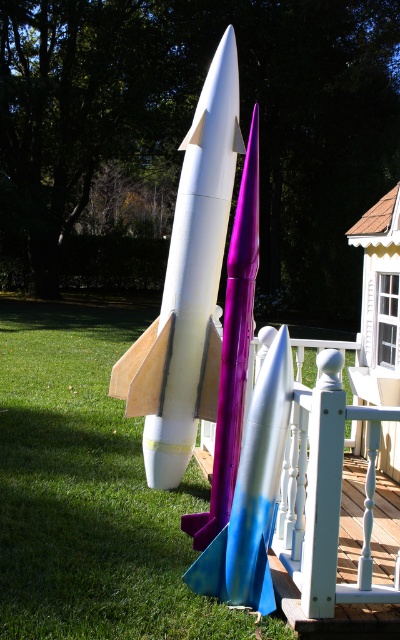
Which is behind, point (249, 413) or point (233, 240)?

Point (233, 240)

Where is `matte purple rocket at center`? This screenshot has width=400, height=640. matte purple rocket at center is located at coordinates (252, 493).

Identify the location of matte purple rocket at center. This screenshot has height=640, width=400. (252, 493).

Where is `matte purple rocket at center`? The image size is (400, 640). matte purple rocket at center is located at coordinates (x=252, y=493).

Who is taller, green grass at center or white matte rocket at center?

white matte rocket at center is taller.

Is green grass at center positioned in front of white matte rocket at center?

Yes, it is in front of white matte rocket at center.

This screenshot has height=640, width=400. What are the coordinates of `green grass at center` in the screenshot? It's located at (91, 493).

Identify the location of green grass at center. The image size is (400, 640). (91, 493).

Does green grass at center have a greater width compared to purple glossy rocket at center?

Correct, the width of green grass at center exceeds that of purple glossy rocket at center.

Is point (142, 308) positioned after point (220, 509)?

Yes.

Is point (80, 346) farther from viewer compared to point (184, 531)?

Yes, point (80, 346) is behind point (184, 531).

Locate an element on the screen. The height and width of the screenshot is (640, 400). green grass at center is located at coordinates (91, 493).